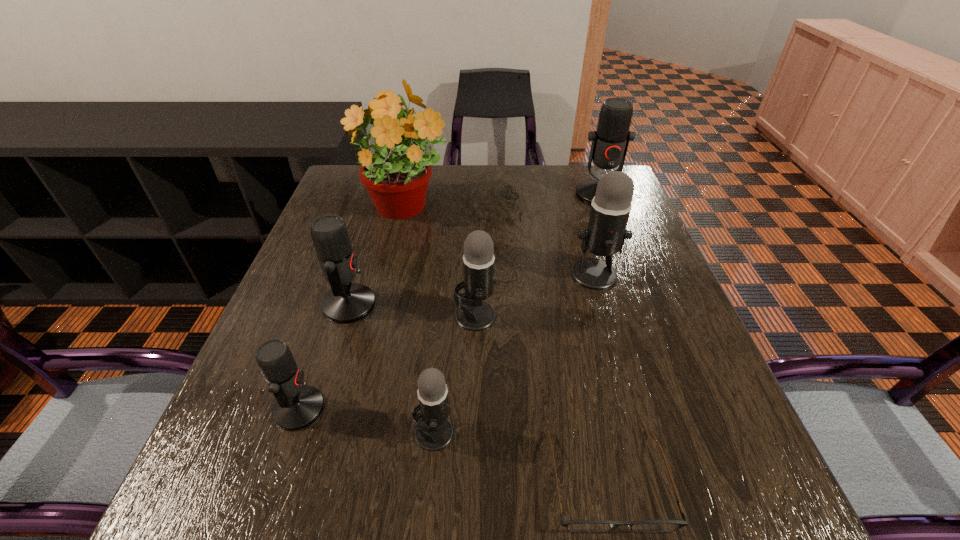
Locate an element on the screen. The width and height of the screenshot is (960, 540). blank space at the near left corner of the desktop is located at coordinates (190, 502).

In the image, there is a desktop. Where is `free space at the far right corner`? This screenshot has height=540, width=960. free space at the far right corner is located at coordinates (595, 172).

Locate an element on the screen. The image size is (960, 540). vacant space that's between the biggest gray microphone and the smallest gray microphone is located at coordinates (515, 353).

The height and width of the screenshot is (540, 960). What are the coordinates of `vacant point located between the rightmost gray microphone and the smallest gray microphone` in the screenshot? It's located at (515, 353).

Find the location of a particular element. The width and height of the screenshot is (960, 540). vacant space in between the smallest gray microphone and the tallest object is located at coordinates 419,321.

The image size is (960, 540). I want to click on free spot between the rightmost red microphone and the second nearest gray microphone, so click(x=538, y=255).

Image resolution: width=960 pixels, height=540 pixels. I want to click on empty space between the flowerpot and the second biggest gray microphone, so click(x=440, y=263).

At what (x,y) coordinates should I click in order to perform the action: click on unoccupied area between the second farthest red microphone and the flowerpot. Please return your answer as a coordinate pair (x, y). Looking at the image, I should click on (376, 258).

Locate an element on the screen. This screenshot has height=540, width=960. empty space that is in between the shortest object and the second biggest gray microphone is located at coordinates (541, 397).

Identify the location of vacant space that is in between the rightmost red microphone and the tallest object. (502, 202).